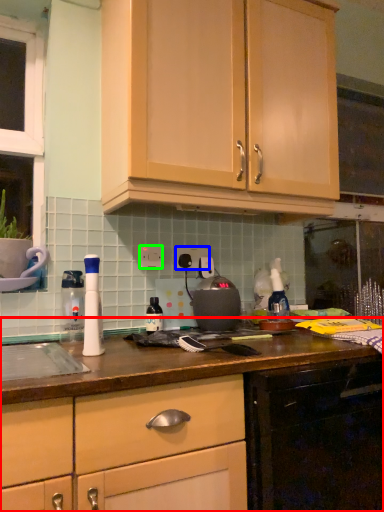
Question: Which object is positioned farthest from cabinetry (highlighted by a red box)? Select from electric outlet (highlighted by a blue box) and electric outlet (highlighted by a green box).

Choices:
 (A) electric outlet
 (B) electric outlet

Answer: (A)